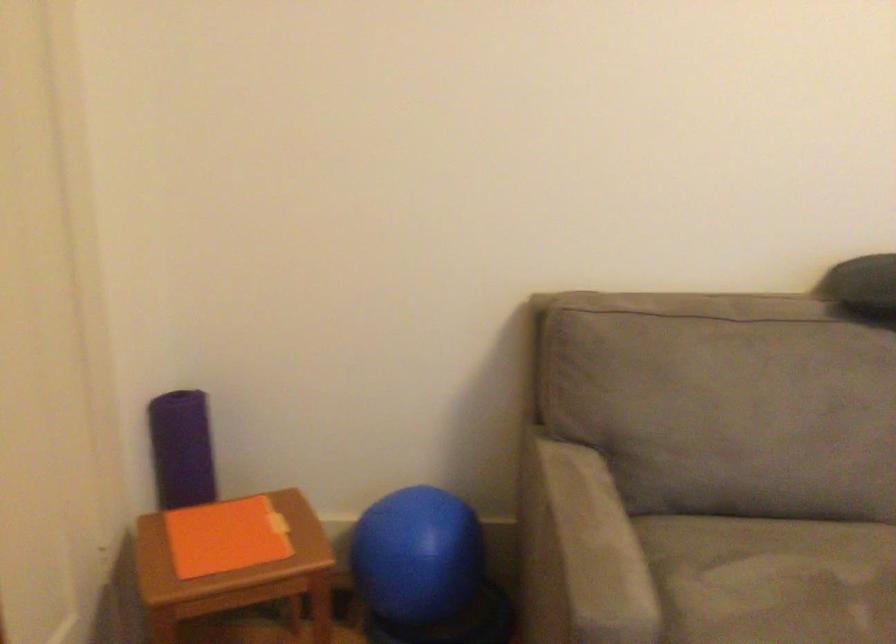
This screenshot has height=644, width=896. Identify the location of purple yoga mat. (182, 449).